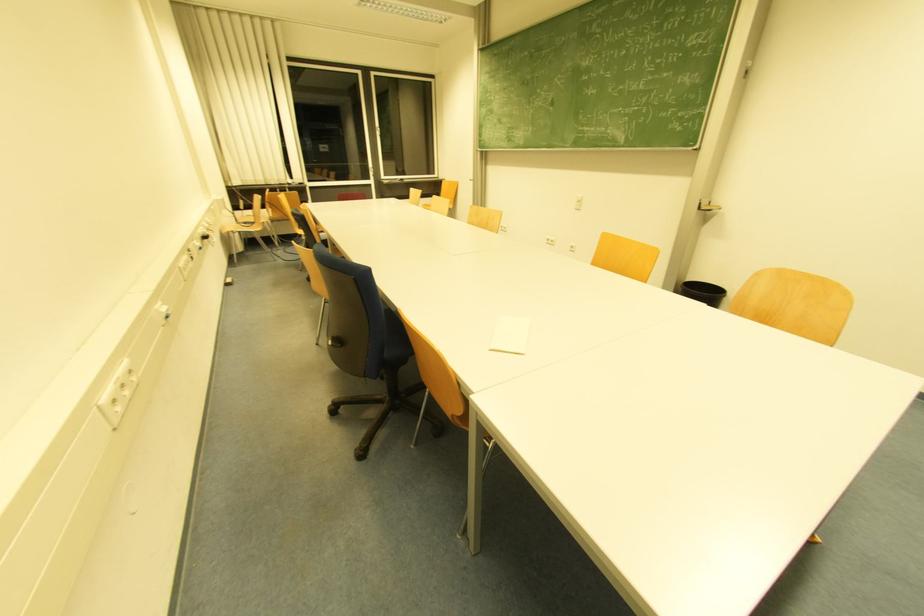
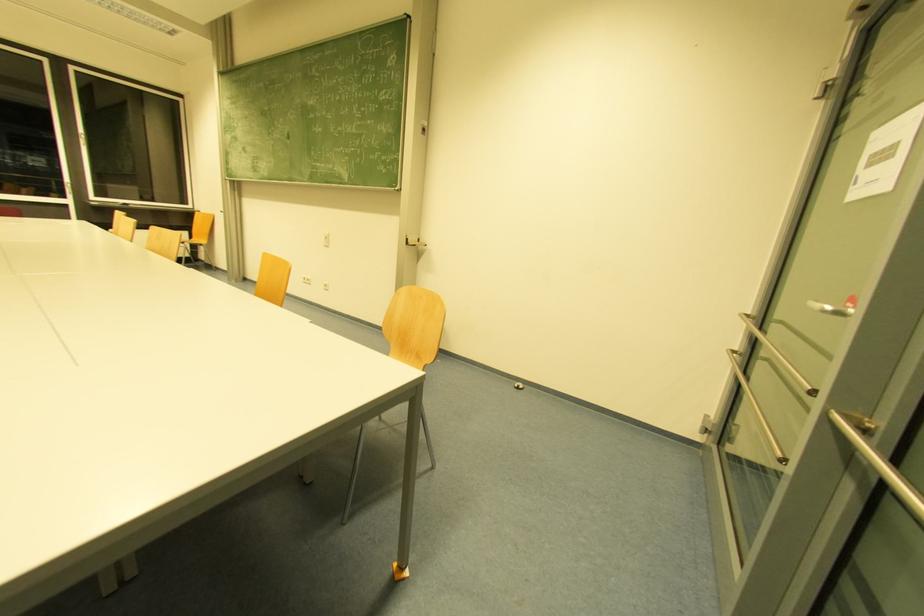
Question: In a continuous first-person perspective shot, in which direction is the camera moving?

Choices:
 (A) Left
 (B) Right
 (C) Forward
 (D) Backward

Answer: (B)